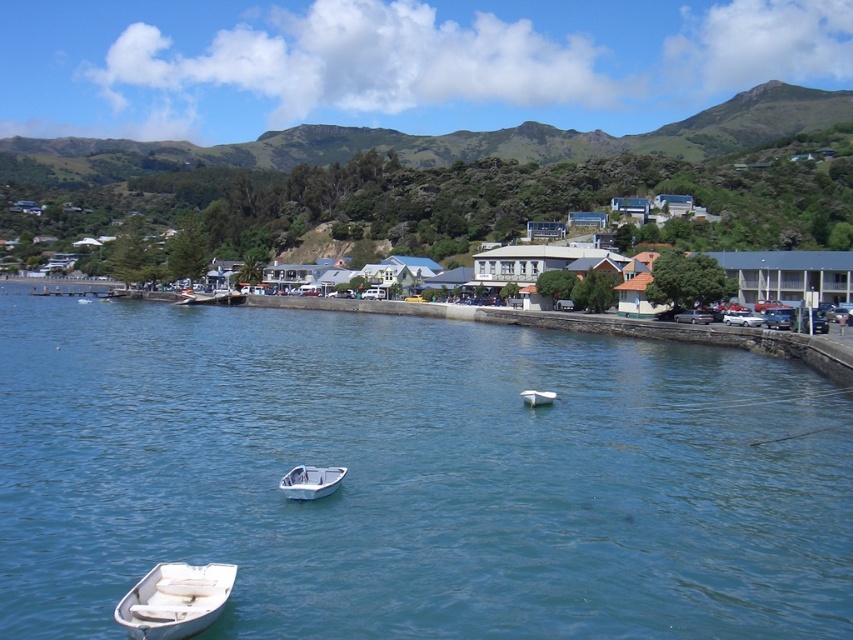
You are standing on the waterfront and want to reach the point marked at coordinates point [219,589]. Given that your walking speed is 1.5 meters per second, how many seconds will it take you to reach that point?

The point [219,589] is 23.26 meters from viewer. At a speed of 1.5 meters per second, it will take 23.26 divided by 1.5, which is approximately 15.5 seconds to reach the point.

You are standing at the waterfront looking out at the boats. There are two points marked on the image, one at coordinates point (221, 596) and the other at point (326, 492). Which point is closer to you?

Point (221, 596) is closer to the camera than point (326, 492), so the first point is closer to you.